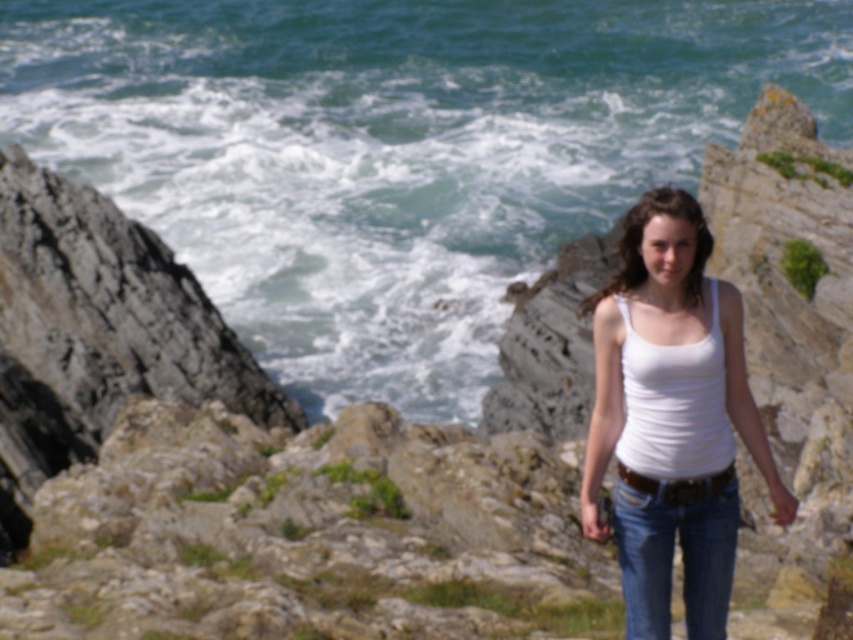
Does white cotton tank top at center have a lesser width compared to blue denim jeans at center?

Incorrect, white cotton tank top at center's width is not less than blue denim jeans at center's.

Is white cotton tank top at center wider than blue denim jeans at center?

Yes.

What do you see at coordinates (671, 419) in the screenshot?
I see `white cotton tank top at center` at bounding box center [671, 419].

At what (x,y) coordinates should I click in order to perform the action: click on white cotton tank top at center. Please return your answer as a coordinate pair (x, y). Looking at the image, I should click on (671, 419).

Does blue water at center have a greater height compared to blue denim jeans at center?

Indeed, blue water at center has a greater height compared to blue denim jeans at center.

Can you confirm if blue water at center is wider than blue denim jeans at center?

Yes, blue water at center is wider than blue denim jeans at center.

Does point (511, 177) come behind point (640, 538)?

Yes, point (511, 177) is farther from viewer.

The height and width of the screenshot is (640, 853). I want to click on blue water at center, so click(x=393, y=152).

Can you confirm if blue water at center is positioned to the left of white cotton tank top at center?

Correct, you'll find blue water at center to the left of white cotton tank top at center.

Measure the distance between point (308, 332) and camera.

30.69 meters

Measure the distance between blue water at center and camera.

89.31 feet

The image size is (853, 640). Identify the location of blue water at center. (393, 152).